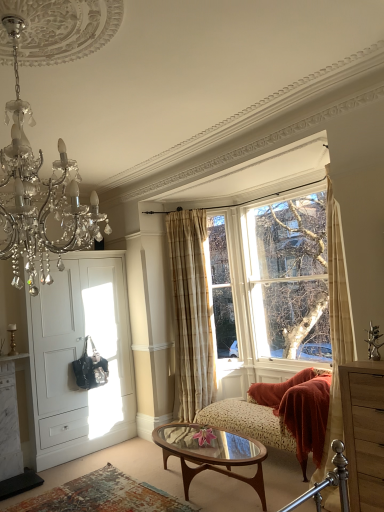
Question: From a real-world perspective, is white matte door at left physically located above or below translucent glass coffee table at center?

Choices:
 (A) above
 (B) below

Answer: (A)

Question: Considering the positions of white matte door at left and translucent glass coffee table at center in the image, is white matte door at left wider or thinner than translucent glass coffee table at center?

Choices:
 (A) wide
 (B) thin

Answer: (B)

Question: Which object is positioned closest to the floral fabric studio couch at center?

Choices:
 (A) crystal chandelier at upper left
 (B) translucent glass coffee table at center
 (C) beige plaid curtain at center
 (D) white matte door at left
 (E) clear glass window at upper right

Answer: (B)

Question: Estimate the real-world distances between objects in this image. Which object is closer to the crystal chandelier at upper left?

Choices:
 (A) clear glass window at upper right
 (B) wooden dresser at right
 (C) beige plaid curtain at center
 (D) floral fabric studio couch at center
 (E) white matte door at left

Answer: (B)